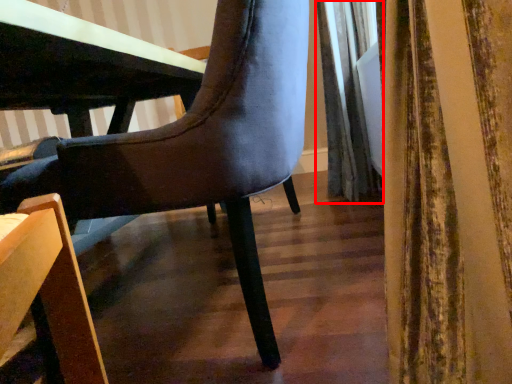
Question: Considering the relative positions of curtain (annotated by the red box) and chair in the image provided, where is curtain (annotated by the red box) located with respect to the staircase?

Choices:
 (A) left
 (B) right

Answer: (B)